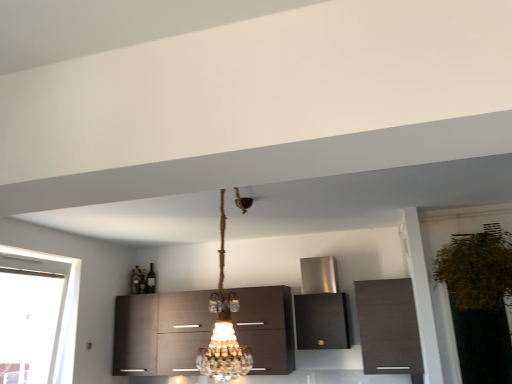
Question: Is green leafy plant at right at the left side of matte brown cabinet at upper right, the first cabinetry positioned from the right?

Choices:
 (A) yes
 (B) no

Answer: (B)

Question: Considering the relative sizes of green leafy plant at right and matte brown cabinet at upper right, which appears as the third cabinetry when viewed from the left, in the image provided, is green leafy plant at right smaller than matte brown cabinet at upper right, which appears as the third cabinetry when viewed from the left,?

Choices:
 (A) no
 (B) yes

Answer: (A)

Question: Is the position of green leafy plant at right less distant than that of matte brown cabinet at upper right, which appears as the third cabinetry when viewed from the left?

Choices:
 (A) yes
 (B) no

Answer: (A)

Question: Could you tell me if green leafy plant at right is facing matte brown cabinet at upper right, the first cabinetry positioned from the right?

Choices:
 (A) no
 (B) yes

Answer: (A)

Question: From a real-world perspective, does green leafy plant at right stand above matte brown cabinet at upper right, the first cabinetry positioned from the right?

Choices:
 (A) no
 (B) yes

Answer: (B)

Question: Do you think green leafy plant at right is within matte brown cabinet at upper right, which appears as the third cabinetry when viewed from the left, or outside of it?

Choices:
 (A) outside
 (B) inside

Answer: (A)

Question: Considering the positions of green leafy plant at right and matte brown cabinet at upper right, which appears as the third cabinetry when viewed from the left, in the image, is green leafy plant at right wider or thinner than matte brown cabinet at upper right, which appears as the third cabinetry when viewed from the left,?

Choices:
 (A) thin
 (B) wide

Answer: (B)

Question: Does point (466, 266) appear closer or farther from the camera than point (394, 296)?

Choices:
 (A) farther
 (B) closer

Answer: (B)

Question: From the image's perspective, relative to matte brown cabinet at upper right, the first cabinetry positioned from the right, is green leafy plant at right above or below?

Choices:
 (A) above
 (B) below

Answer: (A)

Question: Is crystal glass chandelier at center wider or thinner than stainless steel range hood at center, the 2th cabinetry positioned from the right?

Choices:
 (A) wide
 (B) thin

Answer: (A)

Question: Is crystal glass chandelier at center inside the boundaries of stainless steel range hood at center, the 2th cabinetry positioned from the right, or outside?

Choices:
 (A) outside
 (B) inside

Answer: (A)

Question: In terms of height, does crystal glass chandelier at center look taller or shorter compared to stainless steel range hood at center, the 2th cabinetry positioned from the right?

Choices:
 (A) short
 (B) tall

Answer: (B)

Question: From the image's perspective, is crystal glass chandelier at center above or below stainless steel range hood at center, the 2th cabinetry positioned from the right?

Choices:
 (A) below
 (B) above

Answer: (B)

Question: Looking at their shapes, would you say clear glass window at left is wider or thinner than crystal glass chandelier at center?

Choices:
 (A) thin
 (B) wide

Answer: (A)

Question: Would you say clear glass window at left is to the left or to the right of crystal glass chandelier at center in the picture?

Choices:
 (A) left
 (B) right

Answer: (A)